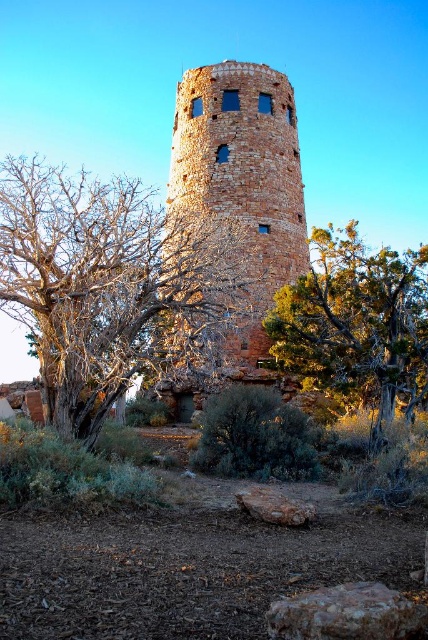
Which is below, bare branches at center or green textured tree at center?

green textured tree at center is lower down.

Does bare branches at center have a lesser width compared to green textured tree at center?

In fact, bare branches at center might be wider than green textured tree at center.

Is point (53, 365) behind point (303, 308)?

No, it is in front of (303, 308).

In order to click on bare branches at center in this screenshot , I will do point(110,284).

Which is more to the right, rustic brick tower at center or green textured tree at center?

Positioned to the right is green textured tree at center.

Is rustic brick tower at center to the left of green textured tree at center from the viewer's perspective?

Correct, you'll find rustic brick tower at center to the left of green textured tree at center.

Between point (175, 166) and point (341, 333), which one is positioned behind?

The point (175, 166) is behind.

I want to click on rustic brick tower at center, so click(x=243, y=182).

Is point (109, 365) closer to viewer compared to point (306, 237)?

Yes, it is.

The height and width of the screenshot is (640, 428). What do you see at coordinates (110, 284) in the screenshot?
I see `bare branches at center` at bounding box center [110, 284].

The height and width of the screenshot is (640, 428). What are the coordinates of `bare branches at center` in the screenshot? It's located at (110, 284).